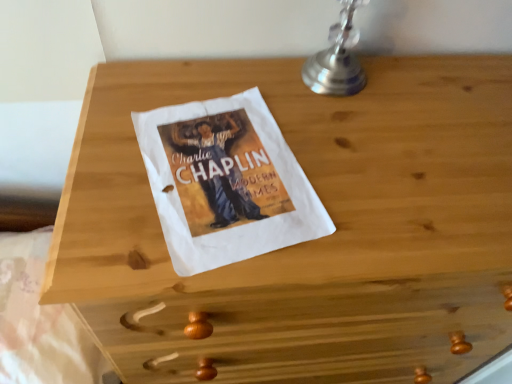
Find the location of a particular element. The image size is (512, 384). silver metallic table lamp at upper right is located at coordinates (337, 58).

The height and width of the screenshot is (384, 512). Describe the element at coordinates (337, 58) in the screenshot. I see `silver metallic table lamp at upper right` at that location.

Image resolution: width=512 pixels, height=384 pixels. What do you see at coordinates (39, 321) in the screenshot?
I see `white paper at lower center` at bounding box center [39, 321].

At what (x,y) coordinates should I click in order to perform the action: click on white paper at lower center. Please return your answer as a coordinate pair (x, y). Looking at the image, I should click on (39, 321).

What is the approximate width of white paper at lower center?

white paper at lower center is 12.21 inches in width.

Locate an element on the screen. The height and width of the screenshot is (384, 512). silver metallic table lamp at upper right is located at coordinates (337, 58).

Does white paper at lower center appear on the right side of silver metallic table lamp at upper right?

No.

Which object is closer to the camera taking this photo, white paper at lower center or silver metallic table lamp at upper right?

silver metallic table lamp at upper right is closer to the camera.

Which is behind, point (92, 362) or point (353, 57)?

The point (92, 362) is more distant.

From the image's perspective, is white paper at lower center located above or below silver metallic table lamp at upper right?

Based on their image positions, white paper at lower center is located beneath silver metallic table lamp at upper right.

From a real-world perspective, which object stands above the other?

From a 3D spatial view, silver metallic table lamp at upper right is above.

Between white paper at lower center and silver metallic table lamp at upper right, which one has larger width?

white paper at lower center.

Considering the relative sizes of white paper at lower center and silver metallic table lamp at upper right in the image provided, is white paper at lower center taller than silver metallic table lamp at upper right?

No.

Looking at this image, can you confirm if white paper at lower center is bigger than silver metallic table lamp at upper right?

Correct, white paper at lower center is larger in size than silver metallic table lamp at upper right.

Is silver metallic table lamp at upper right located within white paper at lower center?

Actually, silver metallic table lamp at upper right is outside white paper at lower center.

Is white paper at lower center next to silver metallic table lamp at upper right and touching it?

No.

Is white paper at lower center oriented towards silver metallic table lamp at upper right?

No, white paper at lower center is not turned towards silver metallic table lamp at upper right.

Where is `sheet below the silver metallic table lamp at upper right (from the image's perspective)`? The image size is (512, 384). sheet below the silver metallic table lamp at upper right (from the image's perspective) is located at coordinates (39, 321).

Can you confirm if silver metallic table lamp at upper right is positioned to the right of white paper at lower center?

Correct, you'll find silver metallic table lamp at upper right to the right of white paper at lower center.

Considering their positions, is silver metallic table lamp at upper right located in front of or behind white paper at lower center?

silver metallic table lamp at upper right is in front of white paper at lower center.

Does point (330, 87) come farther from viewer compared to point (24, 296)?

That is False.

From the image's perspective, which is above, silver metallic table lamp at upper right or white paper at lower center?

silver metallic table lamp at upper right.

From a real-world perspective, is silver metallic table lamp at upper right physically located above or below white paper at lower center?

silver metallic table lamp at upper right is above white paper at lower center.

Which object is thinner, silver metallic table lamp at upper right or white paper at lower center?

silver metallic table lamp at upper right.

Considering the sizes of objects silver metallic table lamp at upper right and white paper at lower center in the image provided, who is taller, silver metallic table lamp at upper right or white paper at lower center?

Standing taller between the two is silver metallic table lamp at upper right.

Between silver metallic table lamp at upper right and white paper at lower center, which one has smaller size?

Smaller between the two is silver metallic table lamp at upper right.

Choose the correct answer: Is silver metallic table lamp at upper right inside white paper at lower center or outside it?

silver metallic table lamp at upper right is located beyond the bounds of white paper at lower center.

Is silver metallic table lamp at upper right not near white paper at lower center?

No, silver metallic table lamp at upper right is not far away from white paper at lower center.

Is silver metallic table lamp at upper right turned away from white paper at lower center?

No.

Can you tell me how much silver metallic table lamp at upper right and white paper at lower center differ in facing direction?

The angular difference between silver metallic table lamp at upper right and white paper at lower center is 4.57 degrees.

Measure the distance from silver metallic table lamp at upper right to white paper at lower center.

silver metallic table lamp at upper right is 26.16 inches from white paper at lower center.

This screenshot has height=384, width=512. I want to click on sheet below the silver metallic table lamp at upper right (from a real-world perspective), so click(39, 321).

At what (x,y) coordinates should I click in order to perform the action: click on table lamp that is on the right side of white paper at lower center. Please return your answer as a coordinate pair (x, y). Looking at the image, I should click on (337, 58).

What are the coordinates of `sheet below the silver metallic table lamp at upper right (from a real-world perspective)` in the screenshot? It's located at (39, 321).